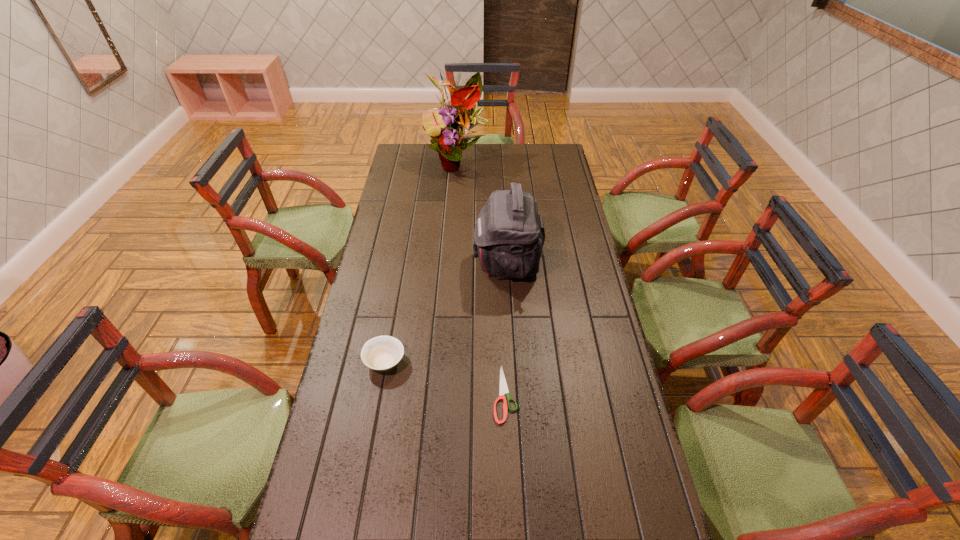
At what (x,y) coordinates should I click in order to perform the action: click on vacant space that is in between the bowl and the second farthest object. Please return your answer as a coordinate pair (x, y). The width and height of the screenshot is (960, 540). Looking at the image, I should click on (445, 312).

Identify the location of vacant region between the scissors and the tallest object. The height and width of the screenshot is (540, 960). (481, 278).

The height and width of the screenshot is (540, 960). I want to click on blank region between the second shortest object and the tallest object, so click(x=421, y=262).

This screenshot has width=960, height=540. Identify the location of vacant area that lies between the scissors and the third nearest object. (506, 328).

Image resolution: width=960 pixels, height=540 pixels. I want to click on blank region between the shoulder bag and the scissors, so click(506, 328).

Where is `free space between the scissors and the second shortest object`? This screenshot has height=540, width=960. free space between the scissors and the second shortest object is located at coordinates (445, 377).

Find the location of a particular element. The width and height of the screenshot is (960, 540). empty location between the bowl and the bouquet is located at coordinates (421, 262).

Identify the location of free space between the scissors and the tallest object. (481, 278).

The width and height of the screenshot is (960, 540). I want to click on free spot between the shoulder bag and the scissors, so click(506, 328).

The width and height of the screenshot is (960, 540). Identify the location of object that can be found as the second closest to the scissors. (509, 235).